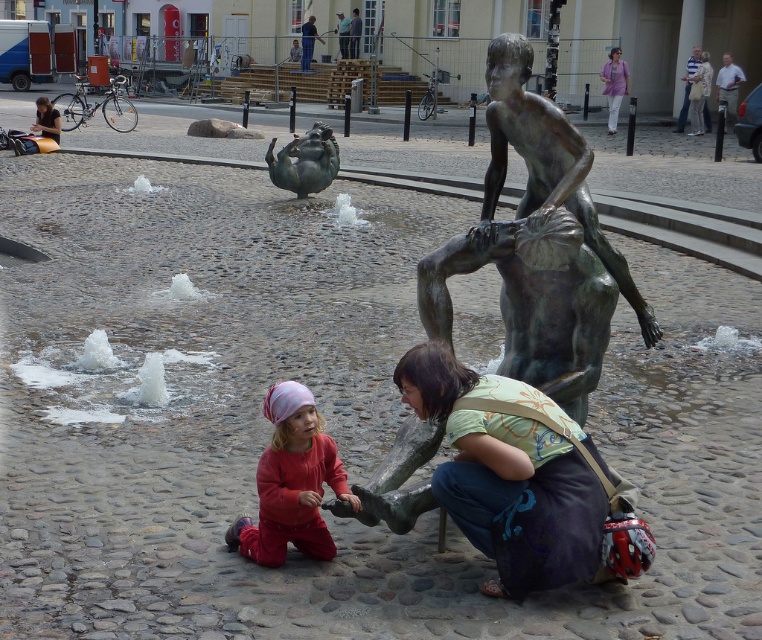
Question: Which object is closer to the camera taking this photo?

Choices:
 (A) light purple fabric shirt at upper right
 (B) bronze statue at center
 (C) bronze sculpture at center

Answer: (B)

Question: Observing the image, what is the correct spatial positioning of bronze sculpture at center in reference to light purple fabric shirt at upper right?

Choices:
 (A) below
 (B) above

Answer: (A)

Question: Which object is the farthest from the bronze statue at center?

Choices:
 (A) light purple fabric shirt at upper right
 (B) matte red pants at lower center
 (C) bronze statue at lower center
 (D) bronze sculpture at center

Answer: (A)

Question: Does matte red pants at lower center appear under bronze sculpture at center?

Choices:
 (A) no
 (B) yes

Answer: (B)

Question: Can you confirm if matte red pants at lower center is positioned to the left of light purple fabric shirt at upper right?

Choices:
 (A) yes
 (B) no

Answer: (A)

Question: Which of the following is the farthest from the observer?

Choices:
 (A) bronze sculpture at center
 (B) light purple fabric shirt at upper right
 (C) bronze statue at center

Answer: (B)